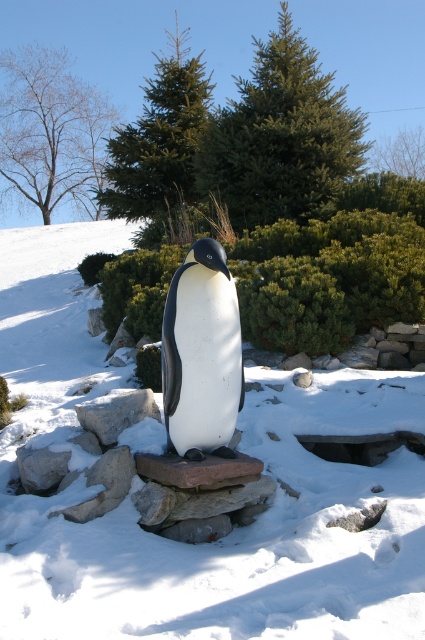
Which is above, white matte penguin at center or gray stone at center?

white matte penguin at center is higher up.

Who is more distant from viewer, (172, 291) or (113, 438)?

Point (113, 438)

Find the location of `white matte penguin at center`. white matte penguin at center is located at coordinates click(201, 353).

Does white snow at center appear on the left side of white matte penguin at center?

Indeed, white snow at center is positioned on the left side of white matte penguin at center.

Can you confirm if white snow at center is wider than white matte penguin at center?

Correct, the width of white snow at center exceeds that of white matte penguin at center.

Is point (306, 408) behind point (172, 378)?

Yes, point (306, 408) is behind point (172, 378).

Locate an element on the screen. The width and height of the screenshot is (425, 640). white snow at center is located at coordinates (234, 529).

Which is more to the right, white snow at center or gray stone at center?

From the viewer's perspective, gray stone at center appears more on the right side.

Between point (115, 236) and point (91, 426), which one is positioned in front?

Point (91, 426)

You are a GUI agent. You are given a task and a screenshot of the screen. Output one action in this format:
    pyautogui.click(x=<x>, y=<y>)
    Task: Click on the white snow at center
    This screenshot has width=425, height=640.
    Given the screenshot: What is the action you would take?
    pyautogui.click(x=234, y=529)